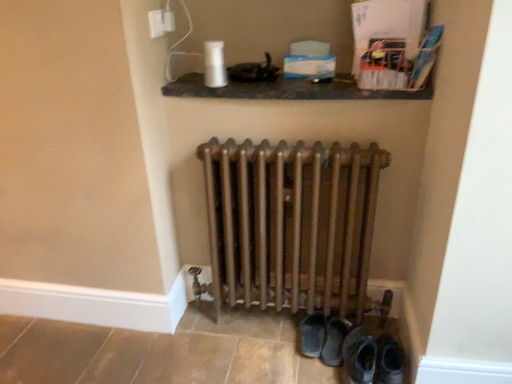
Question: Is matte black shelf at upper center in front of or behind bronze metallic radiator at center in the image?

Choices:
 (A) behind
 (B) front

Answer: (A)

Question: In terms of height, does matte black shelf at upper center look taller or shorter compared to bronze metallic radiator at center?

Choices:
 (A) short
 (B) tall

Answer: (A)

Question: Considering the real-world distances, which object is closest to the white plastic electric outlet at upper center?

Choices:
 (A) bronze metallic radiator at center
 (B) leather boot at lower right, the 1th footwear when ordered from right to left
 (C) dark brown leather shoes at lower center, which is the first footwear in left-to-right order
 (D) matte black shelf at upper center

Answer: (D)

Question: Which of these objects is positioned closest to the dark brown leather shoes at lower center, positioned as the 2th footwear in right-to-left order?

Choices:
 (A) matte black shelf at upper center
 (B) bronze metallic radiator at center
 (C) leather boot at lower right, which appears as the 2th footwear when viewed from the left
 (D) white plastic electric outlet at upper center

Answer: (C)